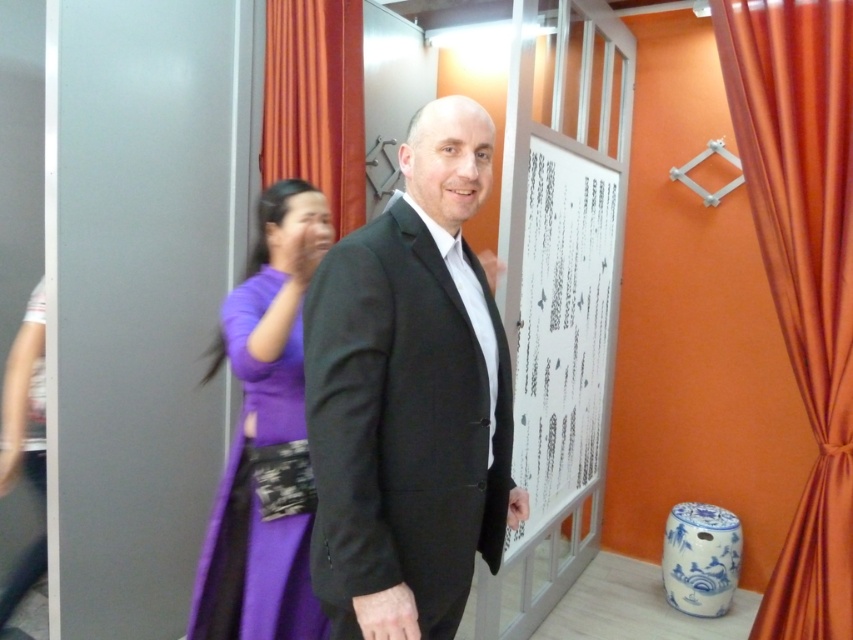
Question: Which point is farther to the camera?

Choices:
 (A) orange satin curtain at right
 (B) white paperboard at center
 (C) black matte suit at center

Answer: (B)

Question: Is orange satin curtain at right to the right of white paperboard at center from the viewer's perspective?

Choices:
 (A) yes
 (B) no

Answer: (A)

Question: In this image, where is black matte suit at center located relative to purple silk dress at left?

Choices:
 (A) below
 (B) above

Answer: (B)

Question: Among these objects, which one is farthest from the camera?

Choices:
 (A) black matte suit at center
 (B) white paperboard at center
 (C) orange satin curtain at right

Answer: (B)

Question: Which of the following is the closest to the observer?

Choices:
 (A) purple silk dress at left
 (B) white paperboard at center
 (C) orange satin curtain at right
 (D) orange satin curtain at upper left

Answer: (A)

Question: Does purple silk dress at left have a smaller size compared to white paperboard at center?

Choices:
 (A) no
 (B) yes

Answer: (B)